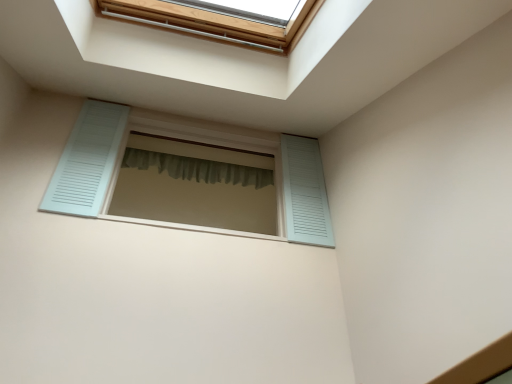
Question: Is green fabric shower curtain at center taller or shorter than light blue wooden shutters at center?

Choices:
 (A) short
 (B) tall

Answer: (A)

Question: Is green fabric shower curtain at center inside the boundaries of light blue wooden shutters at center, or outside?

Choices:
 (A) outside
 (B) inside

Answer: (A)

Question: Does point (182, 157) appear closer or farther from the camera than point (284, 183)?

Choices:
 (A) closer
 (B) farther

Answer: (B)

Question: Is light blue wooden shutters at center taller or shorter than green fabric shower curtain at center?

Choices:
 (A) short
 (B) tall

Answer: (B)

Question: Is light blue wooden shutters at center wider or thinner than green fabric shower curtain at center?

Choices:
 (A) thin
 (B) wide

Answer: (B)

Question: Considering their positions, is light blue wooden shutters at center located in front of or behind green fabric shower curtain at center?

Choices:
 (A) behind
 (B) front

Answer: (B)

Question: From a real-world perspective, is light blue wooden shutters at center positioned above or below green fabric shower curtain at center?

Choices:
 (A) above
 (B) below

Answer: (B)